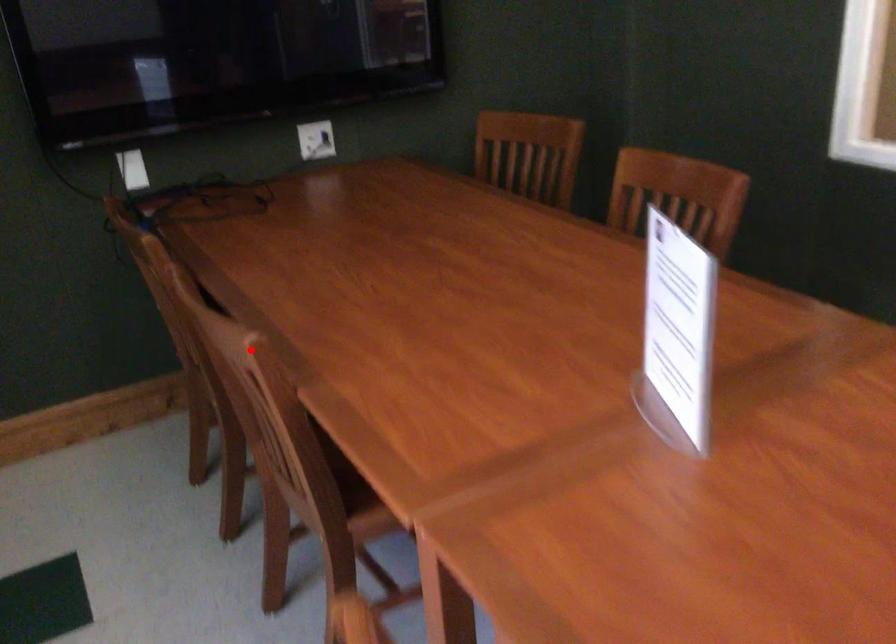
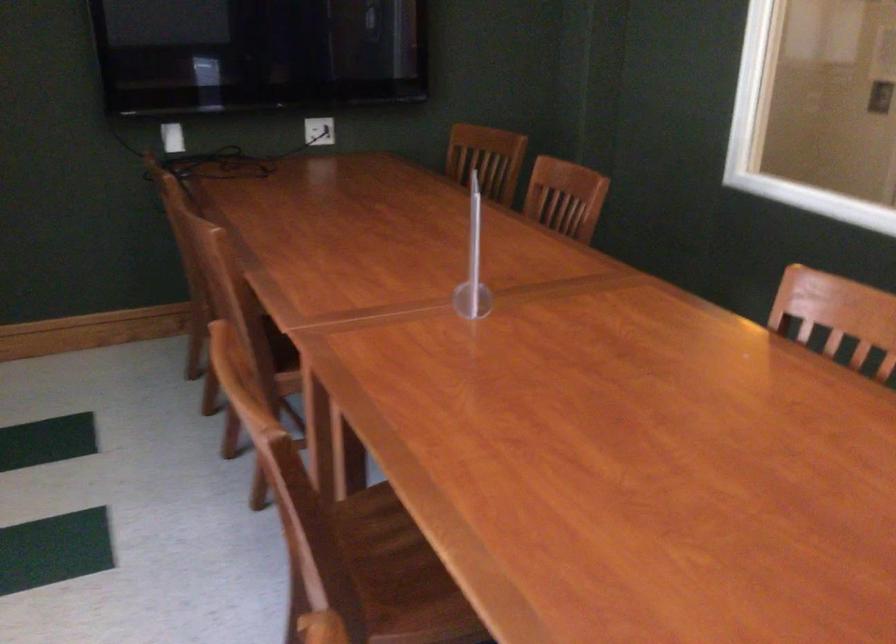
Question: I am providing you with two images of the same scene from different viewpoints. A red point is marked on the first image. At the location where the point appears in image 1, is it still visible in image 2?

Choices:
 (A) Yes
 (B) No

Answer: (A)